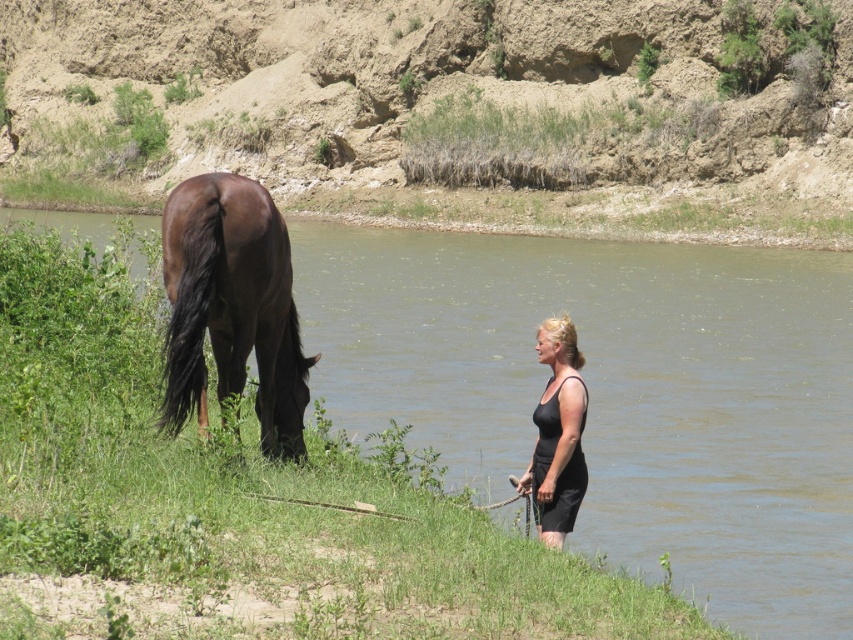
You are a photographer trying to capture the horse in the scene. The horse is at point [231,307]. If you want to focus on the horse, where should you aim your camera?

You should aim your camera at point [231,307] to focus on the shiny dark brown horse at left.

You are a photographer trying to capture a photo of the shiny dark brown horse at left and the black matte dress at lower right in the same frame. The minimum distance your camera can focus on two objects is 2 meters. Will you be able to capture both in focus?

The shiny dark brown horse at left and the black matte dress at lower right are 2.18 meters apart from each other. Since the minimum focusing distance is 2 meters, the camera can focus on both objects as 2.18 meters exceeds the 2 meter requirement.